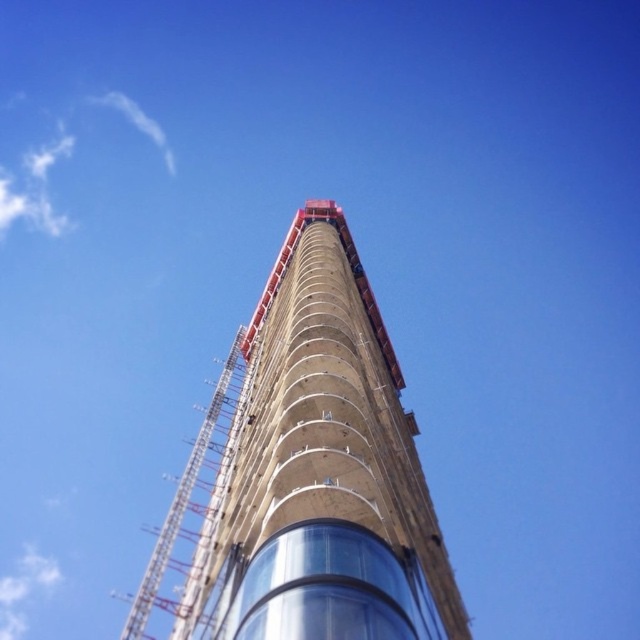
Question: Can you confirm if concrete at center is thinner than metallic scaffolding at center?

Choices:
 (A) no
 (B) yes

Answer: (B)

Question: Which object appears closest to the camera in this image?

Choices:
 (A) concrete at center
 (B) metallic scaffolding at center

Answer: (A)

Question: Which point appears closest to the camera in this image?

Choices:
 (A) (224, 392)
 (B) (211, 554)

Answer: (B)

Question: Can you confirm if concrete at center is smaller than metallic scaffolding at center?

Choices:
 (A) no
 (B) yes

Answer: (B)

Question: Is concrete at center positioned at the back of metallic scaffolding at center?

Choices:
 (A) yes
 (B) no

Answer: (B)